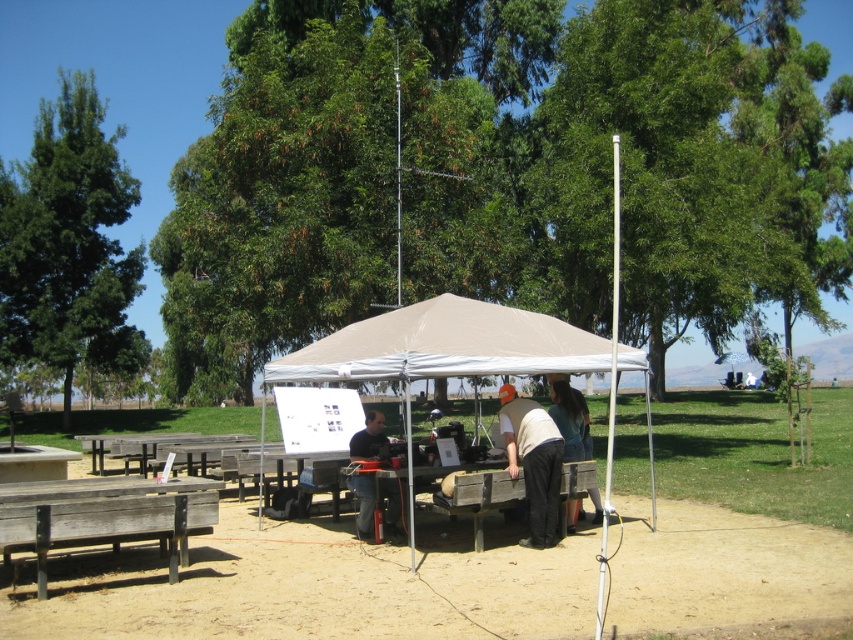
Question: Does green leafy tree at left have a smaller size compared to dark gray shirt at center?

Choices:
 (A) yes
 (B) no

Answer: (B)

Question: Which of the following is the farthest from the observer?

Choices:
 (A) (573, 324)
 (B) (363, 452)

Answer: (A)

Question: Is green leafy tree at left to the left of light beige fabric cap at center from the viewer's perspective?

Choices:
 (A) yes
 (B) no

Answer: (A)

Question: Which of the following is the farthest from the observer?

Choices:
 (A) green leafy tree at upper center
 (B) green leafy tree at left
 (C) wooden bench at lower left

Answer: (B)

Question: Is the position of green leafy tree at upper center less distant than that of light beige fabric cap at center?

Choices:
 (A) yes
 (B) no

Answer: (B)

Question: Which point appears closest to the camera in this image?

Choices:
 (A) (41, 547)
 (B) (384, 481)
 (C) (483, 330)
 (D) (521, 451)

Answer: (A)